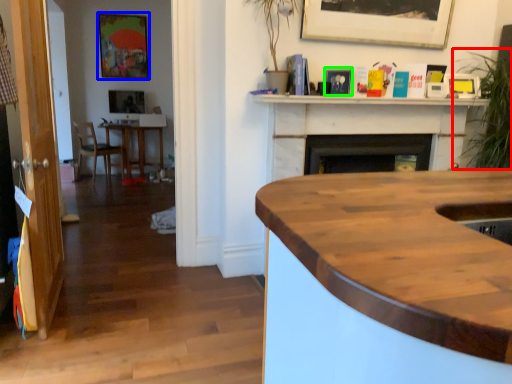
Question: Which object is the closest to the plant (highlighted by a red box)? Choose among these: picture frame (highlighted by a blue box) or picture frame (highlighted by a green box).

Choices:
 (A) picture frame
 (B) picture frame

Answer: (B)